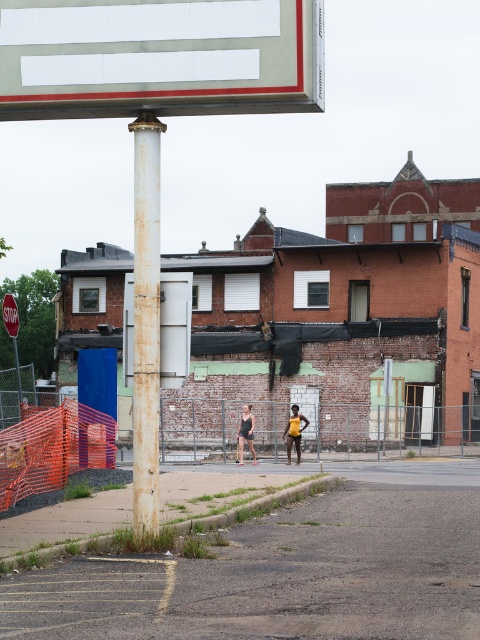
You are standing on the yellow matte shorts at center and want to walk to the smooth asphalt court at center. Which direction should you move?

You should move to the right to reach the smooth asphalt court at center from the yellow matte shorts at center since the smooth asphalt court at center is located to the right of the yellow matte shorts at center.

You are a delivery person trying to park your 1.5 meter wide delivery cart between the smooth asphalt court at center and the matte black tank top at center. Can your cart fit through the space between them?

The smooth asphalt court at center is wider than the matte black tank top at center, so the 1.5 meter wide delivery cart can fit through the space between them as the width is sufficient.